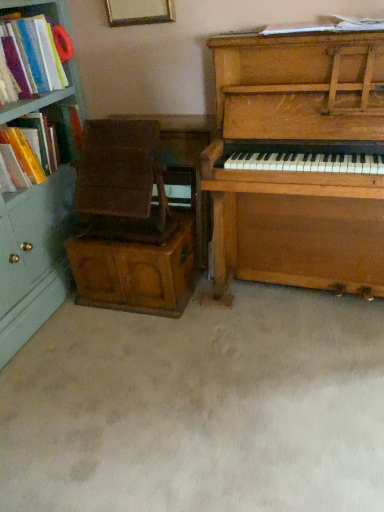
Image resolution: width=384 pixels, height=512 pixels. I want to click on vacant space to the right of wooden armchair at center-left, acting as the 1th armchair starting from the bottom, so click(x=229, y=307).